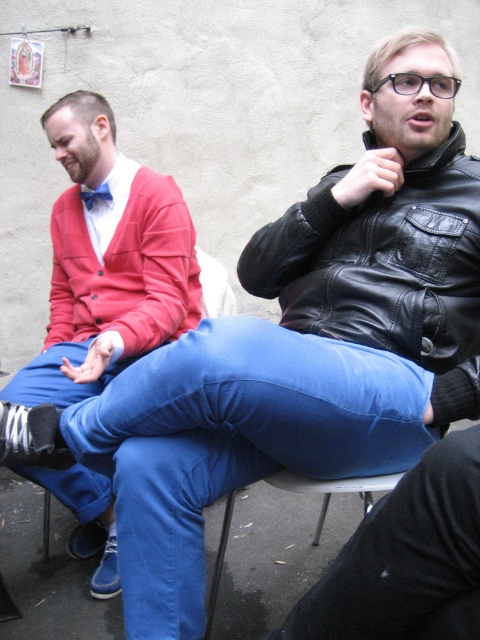
You are designing a new layout for a cozy living room. You want to place the matte red sweater at left and the metallic blue chair at center so that they are both visible but not overcrowded. Given their sizes, which object should be placed closer to the entrance for better visibility?

The matte red sweater at left is bigger than the metallic blue chair at center, so placing the larger matte red sweater at left closer to the entrance will ensure it is more visible while maintaining balance in the space.

In the scene shown: You are a photographer planning to take a portrait of the two people in the scene. You want to ensure both the matte red sweater at left and the blue satin bow tie at upper left are clearly visible in the frame. Given their distance apart, will you need to adjust your camera settings to focus on both objects simultaneously?

The matte red sweater at left is 13.39 inches away from the blue satin bow tie at upper left. Since they are relatively close in distance, the camera can likely focus on both without needing significant adjustments, provided the depth of field is sufficient to keep both within the sharp focus range.

You are a photographer setting up for a portrait. You see the black leather jacket at upper right and the metallic blue chair at center. Which object is located to the right of the other?

The black leather jacket at upper right is positioned on the right side of metallic blue chair at center.